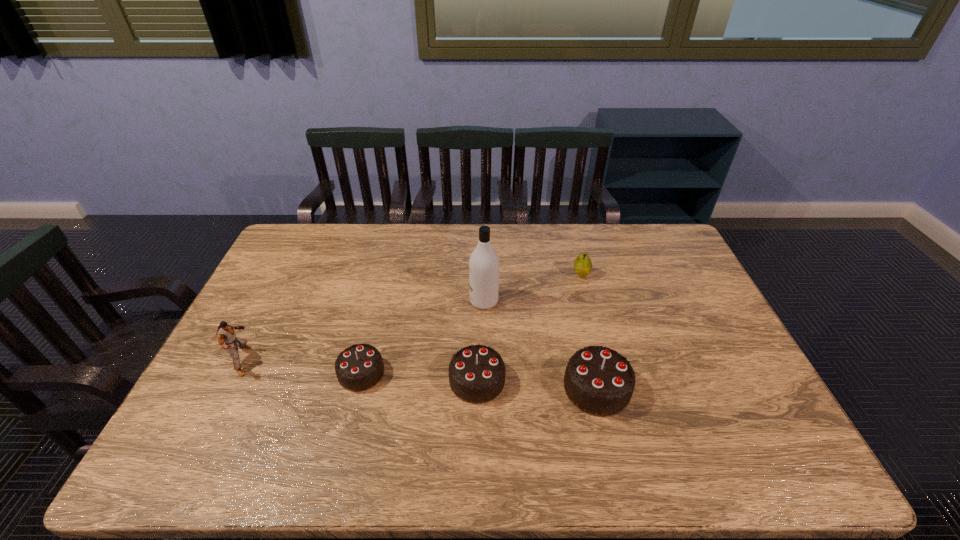
Find the location of a particular element. blank space at the near left corner is located at coordinates (228, 400).

What are the coordinates of `free space between the leftmost object and the rightmost chocolate cake` in the screenshot? It's located at (420, 374).

Find the location of a particular element. vacant space in between the farthest object and the tallest object is located at coordinates (533, 288).

You are a GUI agent. You are given a task and a screenshot of the screen. Output one action in this format:
    pyautogui.click(x=<x>, y=<y>)
    Task: Click on the vacant region between the shampoo and the second object from left to right
    Image resolution: width=960 pixels, height=540 pixels.
    Given the screenshot: What is the action you would take?
    pyautogui.click(x=422, y=337)

Where is `free spot between the shampoo and the pear`? The height and width of the screenshot is (540, 960). free spot between the shampoo and the pear is located at coordinates (533, 288).

Where is `vacant region between the farthest object and the fifth nearest object`? vacant region between the farthest object and the fifth nearest object is located at coordinates (533, 288).

You are a GUI agent. You are given a task and a screenshot of the screen. Output one action in this format:
    pyautogui.click(x=<x>, y=<y>)
    Task: Click on the free space between the leftmost object and the rightmost chocolate cake
    This screenshot has width=960, height=540.
    Given the screenshot: What is the action you would take?
    pyautogui.click(x=420, y=374)

The image size is (960, 540). I want to click on unoccupied area between the second tallest chocolate cake and the rightmost chocolate cake, so click(x=537, y=384).

Identify the location of vacant space that is in between the second chocolate cake from left to right and the shortest chocolate cake. The width and height of the screenshot is (960, 540). (420, 376).

Select which object appears as the second closest to the leftmost chocolate cake. Please provide its 2D coordinates. Your answer should be formatted as a tuple, i.e. [(x, y)], where the tuple contains the x and y coordinates of a point satisfying the conditions above.

[(225, 333)]